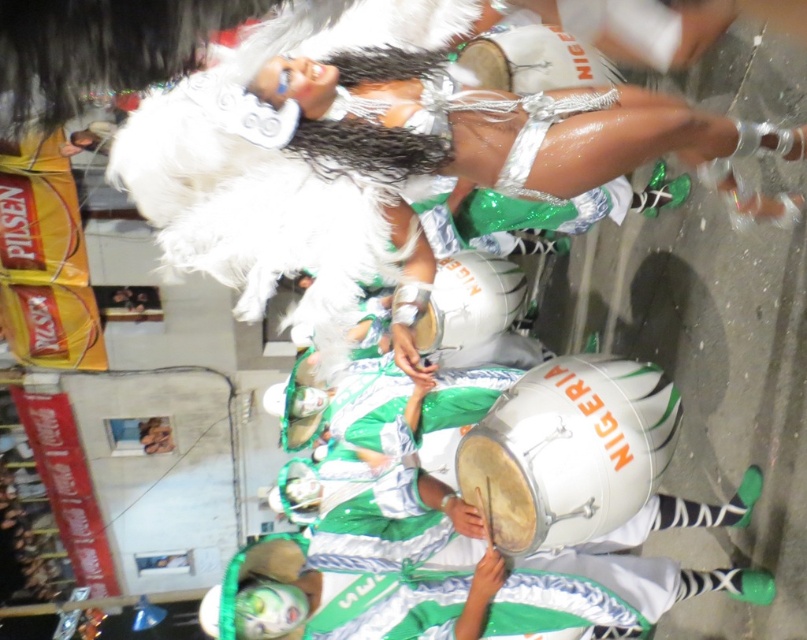
What do you see at coordinates (395, 120) in the screenshot?
I see `shiny silver bikini at center` at bounding box center [395, 120].

Which of these two, shiny silver bikini at center or silver metallic drum at center, stands taller?

silver metallic drum at center

Between point (379, 80) and point (604, 396), which one is positioned in front?

Point (379, 80) is in front.

Find the location of `shiny silver bikini at center`. shiny silver bikini at center is located at coordinates (395, 120).